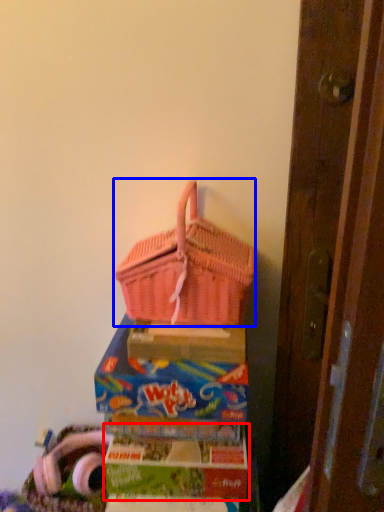
Question: Which object appears farthest to the camera in this image, box (highlighted by a red box) or picnic basket (highlighted by a blue box)?

Choices:
 (A) box
 (B) picnic basket

Answer: (A)